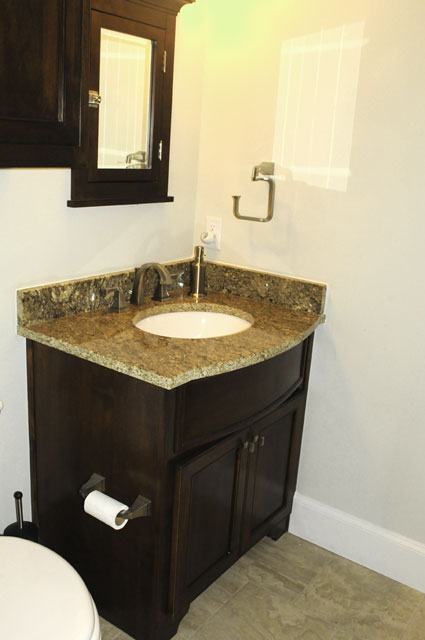
This screenshot has width=425, height=640. In order to click on switch in this screenshot , I will do `click(207, 240)`.